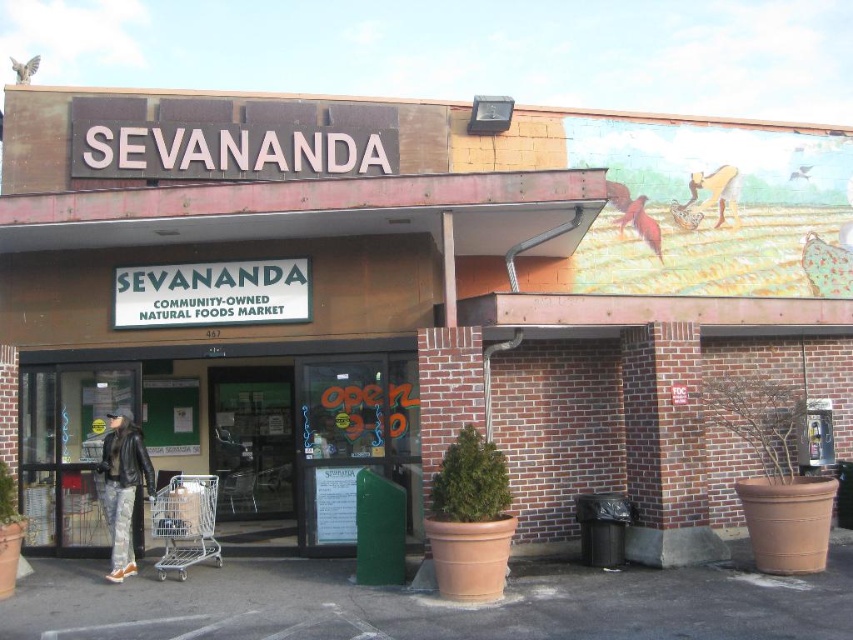
Between point (129, 388) and point (227, 481), which one is positioned behind?

The point (227, 481) is behind.

Does point (225, 365) lie in front of point (225, 410)?

Yes, point (225, 365) is closer to viewer.

Identify the location of metallic shopping cart at center. (224, 426).

Is clear glass door at center positioned before leather jacket at lower left?

No, clear glass door at center is behind leather jacket at lower left.

Who is positioned more to the right, clear glass door at center or leather jacket at lower left?

From the viewer's perspective, clear glass door at center appears more on the right side.

Find the location of a particular element. The width and height of the screenshot is (853, 640). clear glass door at center is located at coordinates (252, 442).

Can you confirm if clear glass door at center is positioned below silver metallic shopping cart at lower left?

No.

Identify the location of clear glass door at center. (252, 442).

I want to click on clear glass door at center, so (x=252, y=442).